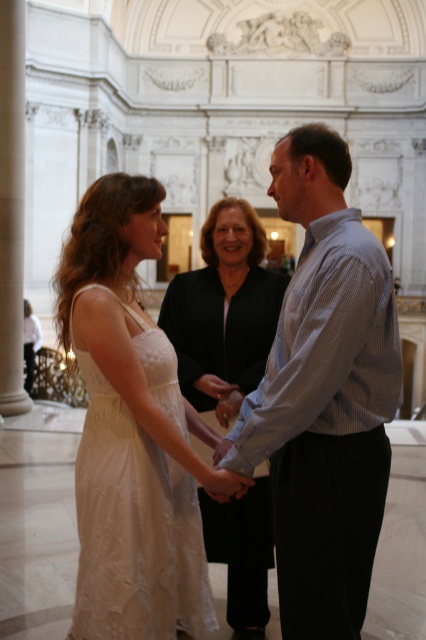
You are standing in the grand building and want to find the blue striped shirt at center. According to the coordinates provided, where should you look to find it?

The blue striped shirt at center is located at coordinates point (x=324, y=396), so you should look towards the lower right area of the image.

You are attending a formal event in this grand building and notice two people at the center holding hands. The blue striped shirt at center and the white lace dress at center are part of their outfits. Based on the description, can you determine which clothing item is positioned higher on the body?

The blue striped shirt at center is above the white lace dress at center, so the blue striped shirt at center is positioned higher on the body.

You are attending a formal event and see two people at the center of the scene. The blue striped shirt at center and the matte black dress at center. Which one is closer to you?

The blue striped shirt at center is closer to you because it is in front of the matte black dress at center.